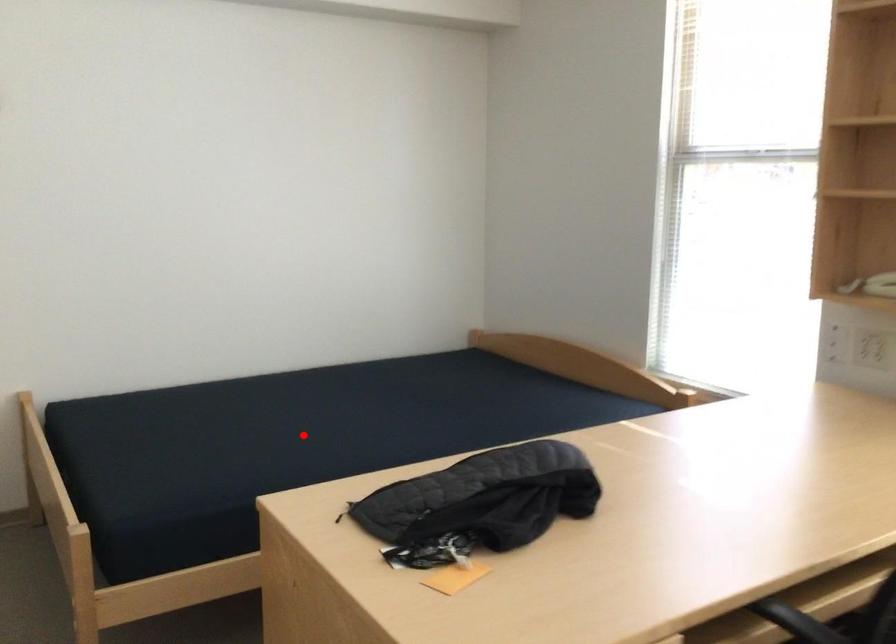
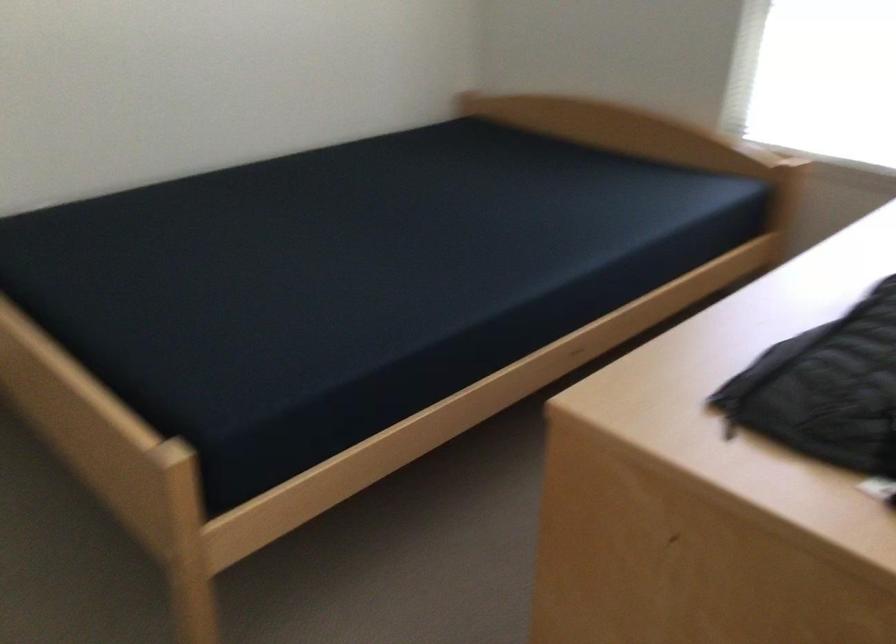
The point at the highlighted location is marked in the first image. Where is the corresponding point in the second image?

(362, 256)